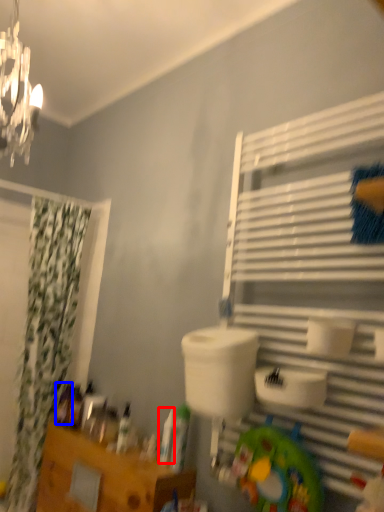
Question: Which object is closer to the camera taking this photo, toiletry (highlighted by a red box) or toiletry (highlighted by a blue box)?

Choices:
 (A) toiletry
 (B) toiletry

Answer: (A)